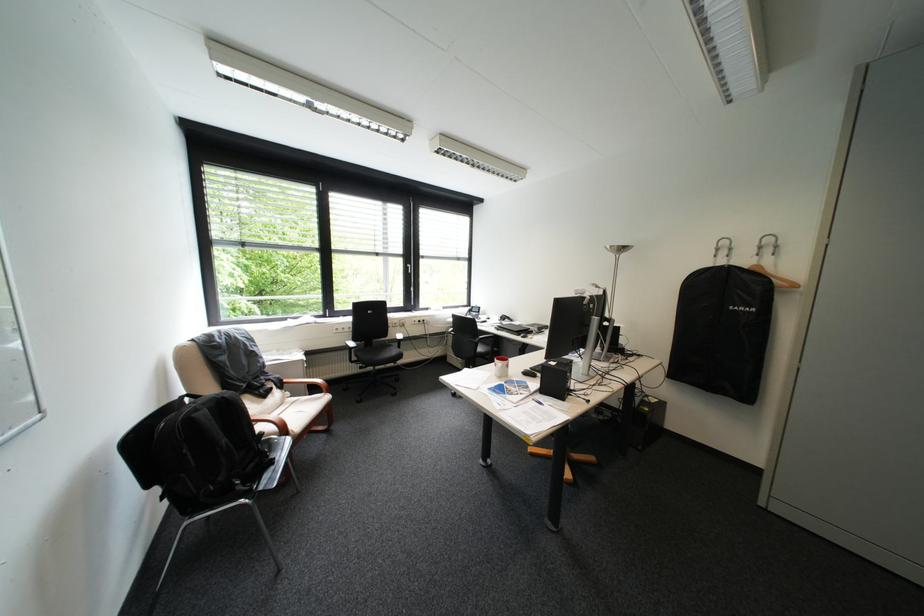
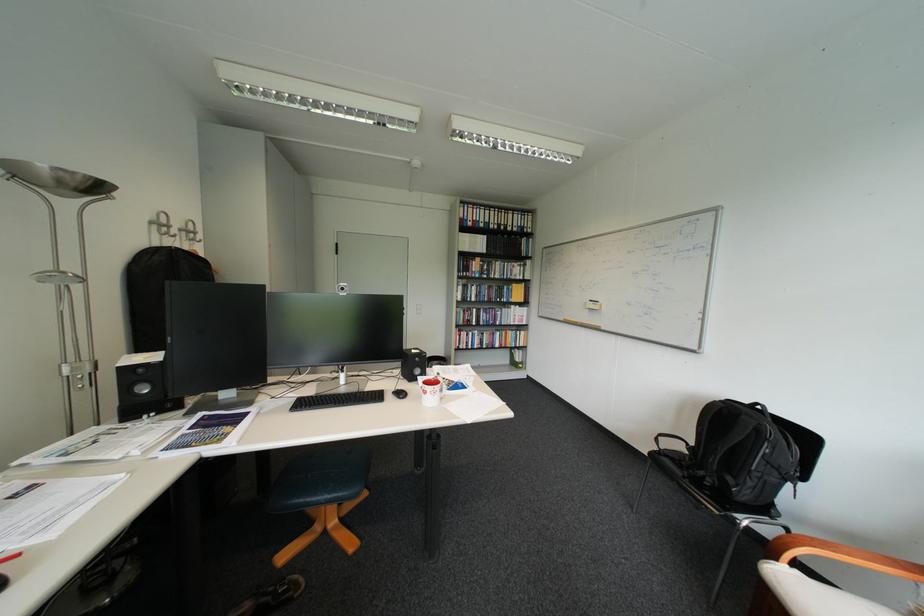
Where in the second image is the point corresponding to the point at 236,398 from the first image?

(756, 418)